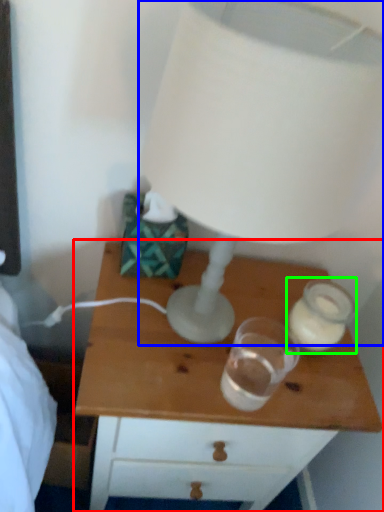
Question: Considering the real-world distances, which object is closest to nightstand (highlighted by a red box)? lamp (highlighted by a blue box) or candle holder (highlighted by a green box).

Choices:
 (A) lamp
 (B) candle holder

Answer: (B)